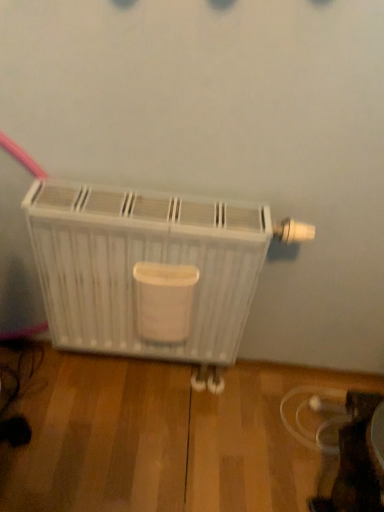
Locate an element on the screen. This screenshot has width=384, height=512. free spot below white plastic radiator at center (from a real-world perspective) is located at coordinates (153, 392).